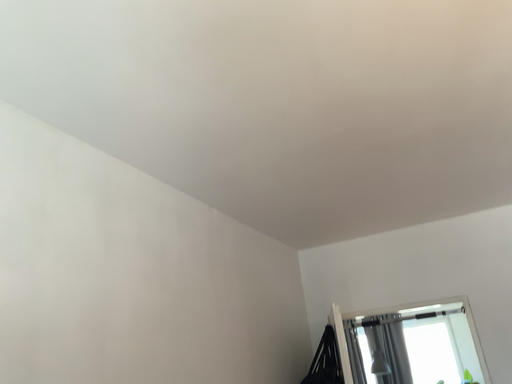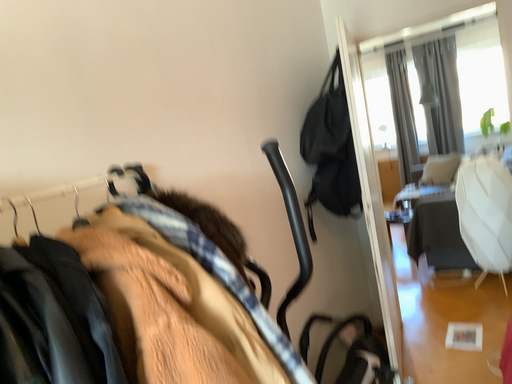
Question: Which way did the camera rotate in the video?

Choices:
 (A) rotated right
 (B) rotated left

Answer: (B)